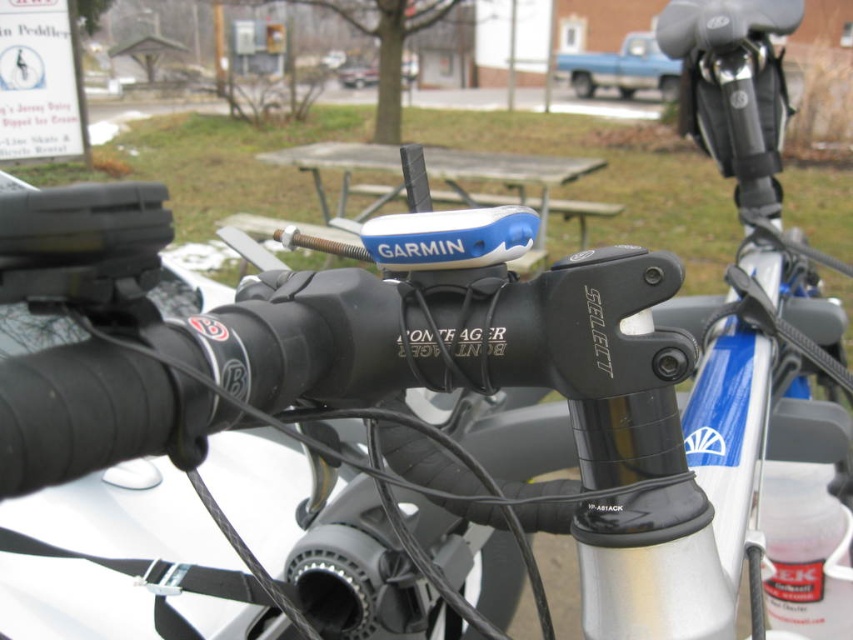
Question: Where is blue plastic picnic table at center located in relation to blue matte truck at upper center in the image?

Choices:
 (A) above
 (B) below

Answer: (B)

Question: Which object is farther from the camera taking this photo?

Choices:
 (A) blue plastic picnic table at center
 (B) blue matte truck at upper center

Answer: (B)

Question: Which point is farther from the camera taking this photo?

Choices:
 (A) click(567, 77)
 (B) click(339, 205)

Answer: (A)

Question: Is the position of blue plastic picnic table at center more distant than that of blue matte truck at upper center?

Choices:
 (A) no
 (B) yes

Answer: (A)

Question: Does blue plastic picnic table at center appear on the left side of blue matte truck at upper center?

Choices:
 (A) no
 (B) yes

Answer: (B)